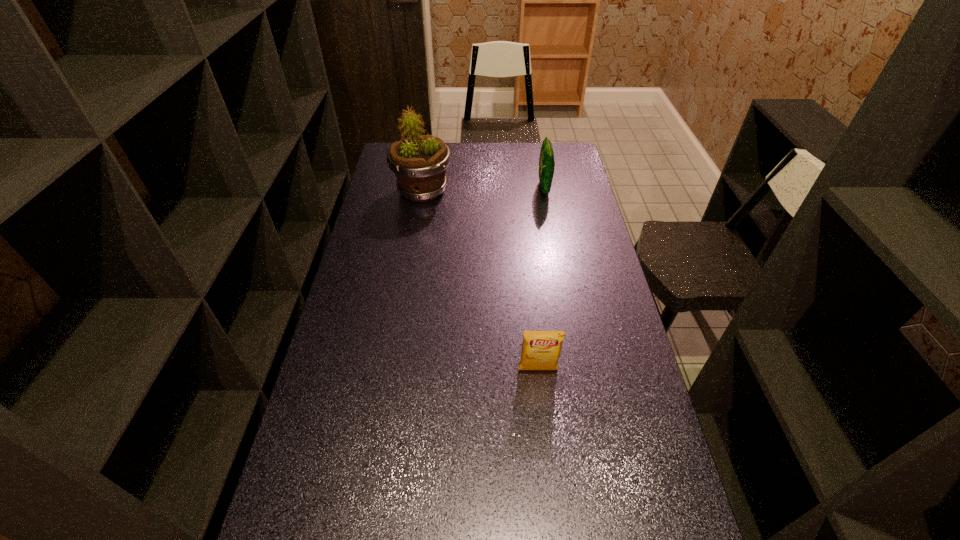
I want to click on free space located 0.240m on the front of the shortest object with the logo, so (548, 461).

This screenshot has width=960, height=540. I want to click on object that is at the left edge, so click(419, 162).

Identify the location of object that is at the right edge. (546, 160).

In the image, there is a desktop. Where is `blank space at the far edge`? blank space at the far edge is located at coordinates (516, 147).

This screenshot has width=960, height=540. I want to click on free space at the left edge, so click(x=368, y=404).

This screenshot has width=960, height=540. In the image, there is a desktop. What are the coordinates of `vacant space at the right edge` in the screenshot? It's located at (610, 399).

Locate an element on the screen. This screenshot has width=960, height=540. free space between the second object from right to left and the flowerpot is located at coordinates (480, 281).

At what (x,y) coordinates should I click in order to perform the action: click on vacant area between the tallest object and the right crisp (potato chip). Please return your answer as a coordinate pair (x, y). This screenshot has width=960, height=540. Looking at the image, I should click on (483, 190).

You are a GUI agent. You are given a task and a screenshot of the screen. Output one action in this format:
    pyautogui.click(x=<x>, y=<y>)
    Task: Click on the unoccupied position between the flowerpot and the farther crisp (potato chip)
    The height and width of the screenshot is (540, 960).
    Given the screenshot: What is the action you would take?
    pyautogui.click(x=483, y=190)

At what (x,y) coordinates should I click in order to perform the action: click on free space between the left crisp (potato chip) and the leftmost object. Please return your answer as a coordinate pair (x, y). The width and height of the screenshot is (960, 540). Looking at the image, I should click on (480, 281).